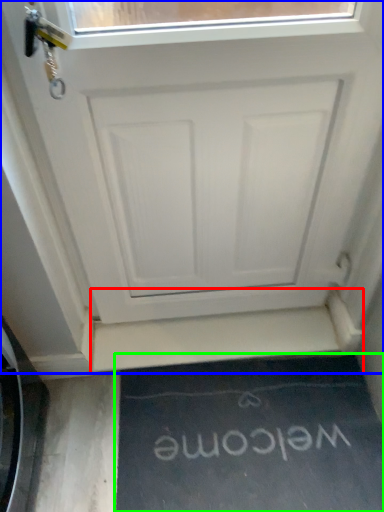
Question: Which object is the closest to the stairwell (highlighted by a red box)? Choose among these: door (highlighted by a blue box) or doormat (highlighted by a green box).

Choices:
 (A) door
 (B) doormat

Answer: (B)